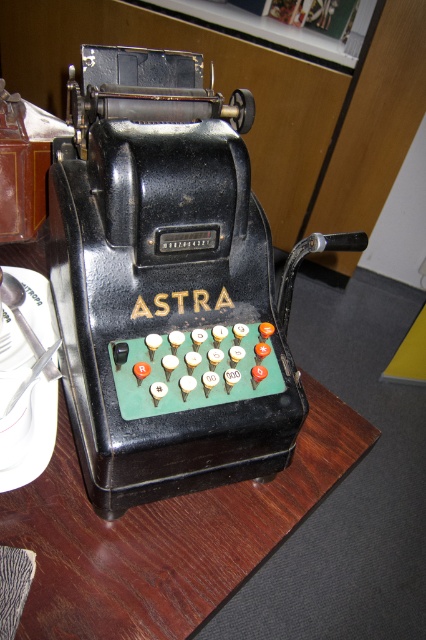
Question: Does black matte register at center have a greater width compared to wooden table at center?

Choices:
 (A) yes
 (B) no

Answer: (B)

Question: Which point is farther to the camera?

Choices:
 (A) (17, 280)
 (B) (189, 531)

Answer: (A)

Question: Which object appears closest to the camera in this image?

Choices:
 (A) wooden table at center
 (B) white glossy plate at lower left
 (C) black matte register at center

Answer: (A)

Question: Is wooden table at center to the right of white glossy plate at lower left from the viewer's perspective?

Choices:
 (A) no
 (B) yes

Answer: (B)

Question: Among these objects, which one is nearest to the camera?

Choices:
 (A) wooden table at center
 (B) black matte register at center
 (C) white glossy plate at lower left

Answer: (A)

Question: Does wooden table at center appear on the left side of white glossy plate at lower left?

Choices:
 (A) no
 (B) yes

Answer: (A)